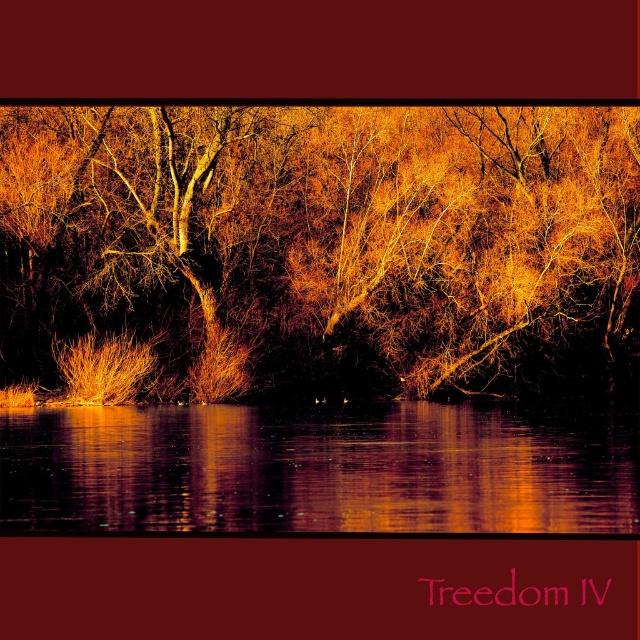
Consider the image. Is golden textured tree at center wider than reflective water at center?

Yes, golden textured tree at center is wider than reflective water at center.

Who is higher up, golden textured tree at center or reflective water at center?

golden textured tree at center

Is point (4, 276) farther from camera compared to point (572, 522)?

Yes, it is.

You are a GUI agent. You are given a task and a screenshot of the screen. Output one action in this format:
    pyautogui.click(x=<x>, y=<y>)
    Task: Click on the golden textured tree at center
    This screenshot has width=640, height=640.
    Given the screenshot: What is the action you would take?
    pyautogui.click(x=317, y=250)